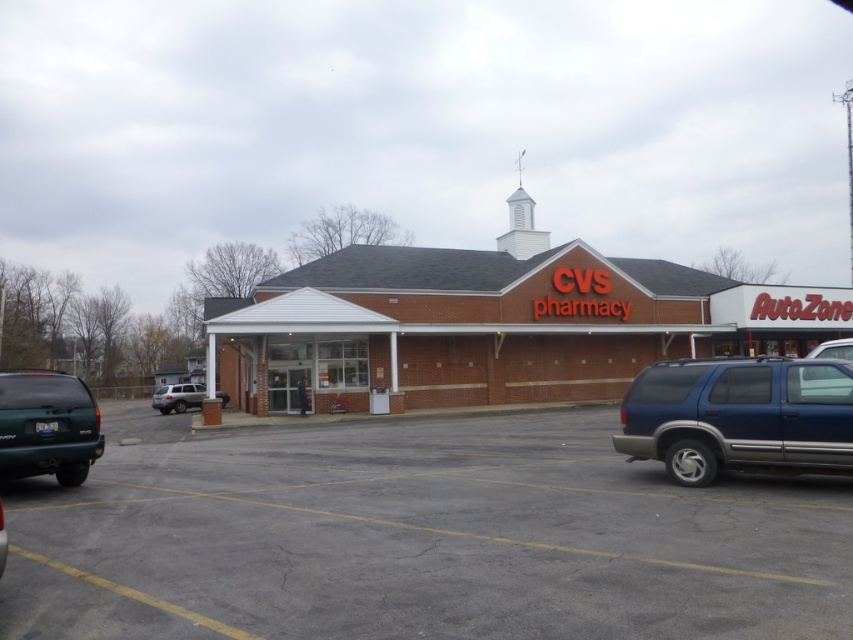
From the picture: Does metallic blue suv at right come behind green matte suv at lower left?

Yes.

Locate an element on the screen. This screenshot has height=640, width=853. metallic blue suv at right is located at coordinates tap(740, 417).

Is point (804, 428) closer to camera compared to point (1, 564)?

No, (804, 428) is further to viewer.

You are a GUI agent. You are given a task and a screenshot of the screen. Output one action in this format:
    pyautogui.click(x=<x>, y=<y>)
    Task: Click on the metallic blue suv at right
    Image resolution: width=853 pixels, height=640 pixels.
    Given the screenshot: What is the action you would take?
    pyautogui.click(x=740, y=417)

Can you confirm if gray asphalt parking lot at center is positioned to the right of teal matte suv at lower left?

Correct, you'll find gray asphalt parking lot at center to the right of teal matte suv at lower left.

Based on the photo, which of these two, gray asphalt parking lot at center or teal matte suv at lower left, stands taller?

With more height is teal matte suv at lower left.

What do you see at coordinates (416, 536) in the screenshot? I see `gray asphalt parking lot at center` at bounding box center [416, 536].

The height and width of the screenshot is (640, 853). Identify the location of gray asphalt parking lot at center. (416, 536).

Is teal matte suv at lower left below green matte suv at lower left?

Incorrect, teal matte suv at lower left is not positioned below green matte suv at lower left.

Can you confirm if teal matte suv at lower left is smaller than green matte suv at lower left?

Actually, teal matte suv at lower left might be larger than green matte suv at lower left.

Who is more distant from viewer, (33,419) or (0,556)?

The point (33,419) is more distant.

I want to click on teal matte suv at lower left, so click(x=47, y=426).